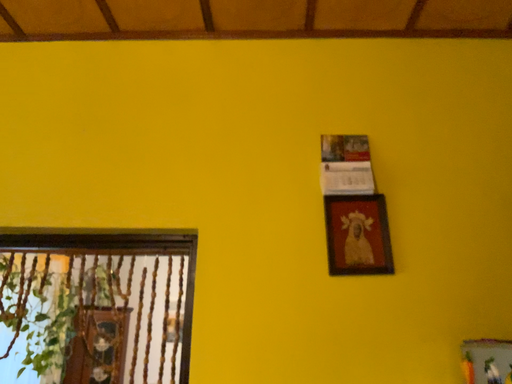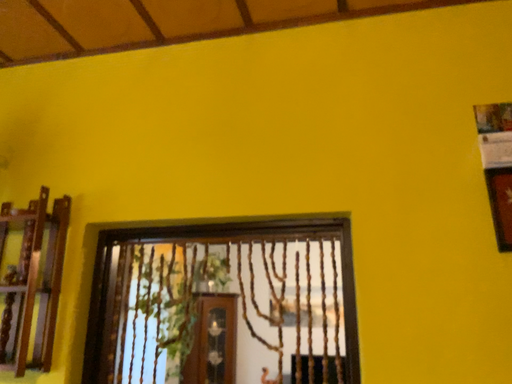
Question: How did the camera likely rotate when shooting the video?

Choices:
 (A) rotated left
 (B) rotated right

Answer: (A)